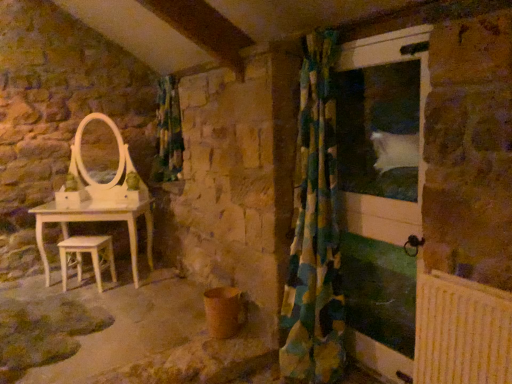
In order to face light wood stool at lower left, should I rotate leftwards or rightwards?

Rotate your view left by about 21.525°.

What do you see at coordinates (314, 231) in the screenshot? I see `green-yellow checkered curtain at right` at bounding box center [314, 231].

You are a GUI agent. You are given a task and a screenshot of the screen. Output one action in this format:
    pyautogui.click(x=<x>, y=<y>)
    Task: Click on the green and blue checkered fabric at center
    
    Given the screenshot: What is the action you would take?
    pyautogui.click(x=168, y=132)

This screenshot has width=512, height=384. What do you see at coordinates (168, 132) in the screenshot? I see `green and blue checkered fabric at center` at bounding box center [168, 132].

You are a GUI agent. You are given a task and a screenshot of the screen. Output one action in this format:
    pyautogui.click(x=<x>, y=<y>)
    Task: Click on the white glossy screen door at right
    
    Given the screenshot: What is the action you would take?
    pyautogui.click(x=417, y=136)

Locate an element on the screen. light wood stool at lower left is located at coordinates (90, 254).

Is point (76, 264) more distant than point (317, 149)?

Yes, point (76, 264) is behind point (317, 149).

Does light wood stool at lower left lie behind green-yellow checkered curtain at right?

Yes, light wood stool at lower left is further from the camera.

Who is bigger, light wood stool at lower left or green-yellow checkered curtain at right?

Bigger between the two is green-yellow checkered curtain at right.

Is there a large distance between light wood stool at lower left and green-yellow checkered curtain at right?

Yes, light wood stool at lower left is far from green-yellow checkered curtain at right.

From the image's perspective, between green and blue checkered fabric at center and light wood stool at lower left, which one is located above?

green and blue checkered fabric at center is shown above in the image.

Are green and blue checkered fabric at center and light wood stool at lower left located far from each other?

Yes, green and blue checkered fabric at center and light wood stool at lower left are located far from each other.

Which of these two, green and blue checkered fabric at center or light wood stool at lower left, stands shorter?

Standing shorter between the two is light wood stool at lower left.

Is green and blue checkered fabric at center wider than light wood stool at lower left?

Yes.

The image size is (512, 384). Find the location of `curtain below the green and blue checkered fabric at center (from the image's perspective)`. curtain below the green and blue checkered fabric at center (from the image's perspective) is located at coordinates (314, 231).

From a real-world perspective, is green and blue checkered fabric at center on top of green-yellow checkered curtain at right?

Yes.

Could you measure the distance between green and blue checkered fabric at center and green-yellow checkered curtain at right?

green and blue checkered fabric at center and green-yellow checkered curtain at right are 7.60 feet apart from each other.

Is the position of green and blue checkered fabric at center more distant than that of green-yellow checkered curtain at right?

That is True.

Considering the positions of objects white glossy screen door at right and light wood stool at lower left in the image provided, who is more to the right, white glossy screen door at right or light wood stool at lower left?

white glossy screen door at right.

In the scene shown: Does white glossy screen door at right come in front of light wood stool at lower left?

Yes, it is in front of light wood stool at lower left.

Is green-yellow checkered curtain at right inside the boundaries of white glossy screen door at right, or outside?

The correct answer is: outside.

How different are the orientations of green-yellow checkered curtain at right and white glossy screen door at right in degrees?

The angular difference between green-yellow checkered curtain at right and white glossy screen door at right is 0.631 degrees.

Where is `screen door that appears in front of the green-yellow checkered curtain at right`? screen door that appears in front of the green-yellow checkered curtain at right is located at coordinates (417, 136).

Is light wood stool at lower left oriented towards white glossy screen door at right?

No.

Looking at this image, from a real-world perspective, does light wood stool at lower left sit lower than white glossy screen door at right?

Yes, from a real-world perspective, light wood stool at lower left is beneath white glossy screen door at right.

Between light wood stool at lower left and white glossy screen door at right, which one has smaller width?

white glossy screen door at right is thinner.

Measure the distance from light wood stool at lower left to white glossy screen door at right.

8.63 feet.

Which object is thinner, white glossy screen door at right or green-yellow checkered curtain at right?

Thinner between the two is white glossy screen door at right.

From a real-world perspective, is white glossy screen door at right positioned over green-yellow checkered curtain at right based on gravity?

No.

From the image's perspective, which object appears higher, white glossy screen door at right or green-yellow checkered curtain at right?

green-yellow checkered curtain at right.

Locate an element on the screen. The width and height of the screenshot is (512, 384). stool directly beneath the green-yellow checkered curtain at right (from a real-world perspective) is located at coordinates (90, 254).

Image resolution: width=512 pixels, height=384 pixels. In order to click on shower curtain to the right of light wood stool at lower left in this screenshot , I will do point(168,132).

Estimate the real-world distances between objects in this image. Which object is closer to green and blue checkered fabric at center, light wood stool at lower left or white glossy screen door at right?

The object closer to green and blue checkered fabric at center is light wood stool at lower left.

When comparing their distances from green and blue checkered fabric at center, does green-yellow checkered curtain at right or light wood stool at lower left seem closer?

light wood stool at lower left lies closer to green and blue checkered fabric at center than the other object.

From the image, which object appears to be nearer to green and blue checkered fabric at center, white glossy screen door at right or green-yellow checkered curtain at right?

Among the two, green-yellow checkered curtain at right is located nearer to green and blue checkered fabric at center.

From the image, which object appears to be nearer to light wood stool at lower left, white glossy screen door at right or green and blue checkered fabric at center?

Among the two, green and blue checkered fabric at center is located nearer to light wood stool at lower left.

Based on their spatial positions, is light wood stool at lower left or green-yellow checkered curtain at right further from green and blue checkered fabric at center?

green-yellow checkered curtain at right is positioned further to the anchor green and blue checkered fabric at center.

When comparing their distances from white glossy screen door at right, does green-yellow checkered curtain at right or light wood stool at lower left seem further?

light wood stool at lower left.

Considering their positions, is green-yellow checkered curtain at right positioned further to light wood stool at lower left than white glossy screen door at right?

white glossy screen door at right is further to light wood stool at lower left.

Considering their positions, is light wood stool at lower left positioned further to green-yellow checkered curtain at right than green and blue checkered fabric at center?

green and blue checkered fabric at center.

Find the location of a particular element. This screenshot has width=512, height=384. stool between white glossy screen door at right and green and blue checkered fabric at center from front to back is located at coordinates (90, 254).

At what (x,y) coordinates should I click in order to perform the action: click on curtain between light wood stool at lower left and white glossy screen door at right from left to right. Please return your answer as a coordinate pair (x, y). The height and width of the screenshot is (384, 512). Looking at the image, I should click on (314, 231).

At what (x,y) coordinates should I click in order to perform the action: click on stool between green-yellow checkered curtain at right and green and blue checkered fabric at center along the z-axis. Please return your answer as a coordinate pair (x, y). This screenshot has height=384, width=512. Looking at the image, I should click on (x=90, y=254).

At what (x,y) coordinates should I click in order to perform the action: click on curtain between white glossy screen door at right and green and blue checkered fabric at center along the z-axis. Please return your answer as a coordinate pair (x, y). This screenshot has height=384, width=512. Looking at the image, I should click on (314, 231).